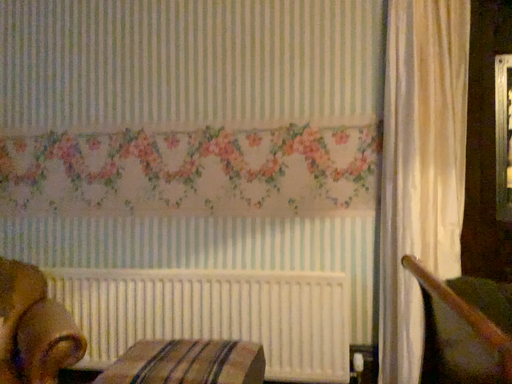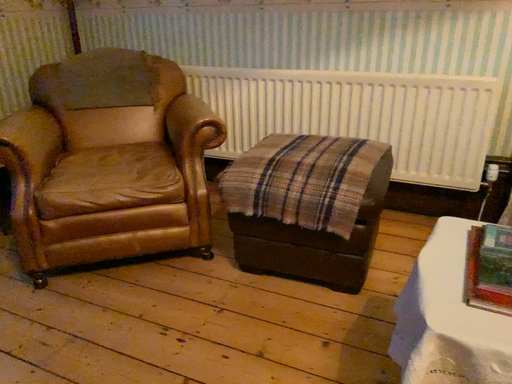
Question: How did the camera likely rotate when shooting the video?

Choices:
 (A) rotated left
 (B) rotated right

Answer: (A)